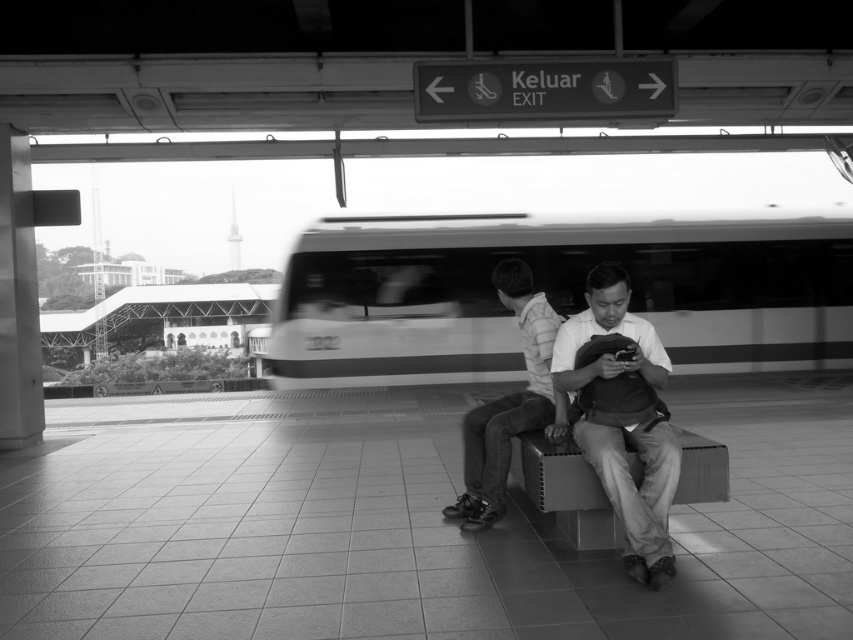
Question: Can you confirm if striped cotton shirt at center is thinner than metallic gray bench at center?

Choices:
 (A) yes
 (B) no

Answer: (A)

Question: From the image, what is the correct spatial relationship of smooth fabric shirt at center in relation to striped cotton shirt at center?

Choices:
 (A) below
 (B) above

Answer: (A)

Question: Which object is positioned closest to the smooth white train at center?

Choices:
 (A) striped cotton shirt at center
 (B) metallic gray bench at center
 (C) smooth fabric shirt at center

Answer: (A)

Question: Which point is farther from the camera taking this photo?

Choices:
 (A) (674, 496)
 (B) (378, 365)
 (C) (546, 378)

Answer: (B)

Question: Which object is closer to the camera taking this photo?

Choices:
 (A) smooth white train at center
 (B) metallic gray bench at center
 (C) striped cotton shirt at center
 (D) smooth fabric shirt at center

Answer: (D)

Question: Does smooth fabric shirt at center come in front of metallic gray bench at center?

Choices:
 (A) no
 (B) yes

Answer: (B)